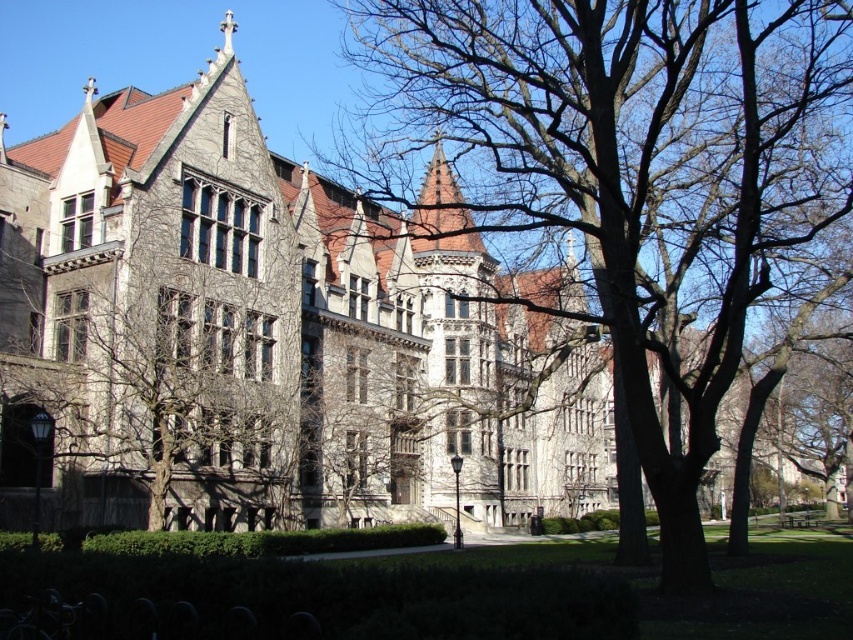
You are standing in front of the grand historic building and notice two trees at the center of the image. Which tree, the brown bark tree at center or the gray stone tree at center, is closer to you?

The brown bark tree at center is closer to you as it is positioned in front of the gray stone tree at center.

You are standing in front of the grand historic building and notice two trees at the center of the image. Which tree, the brown bark tree at center or the gray stone tree at center, appears closer to you?

The brown bark tree at center appears closer because it is positioned over the gray stone tree at center, indicating it is in front.

You are an architect analyzing the symmetry of the historic building. You notice two trees at the center of the image, a brown bark tree at center and a gray stone tree at center. Which tree would you describe as being more prominent in size within the composition?

The brown bark tree at center is larger in size than the gray stone tree at center, making it more prominent in the composition.